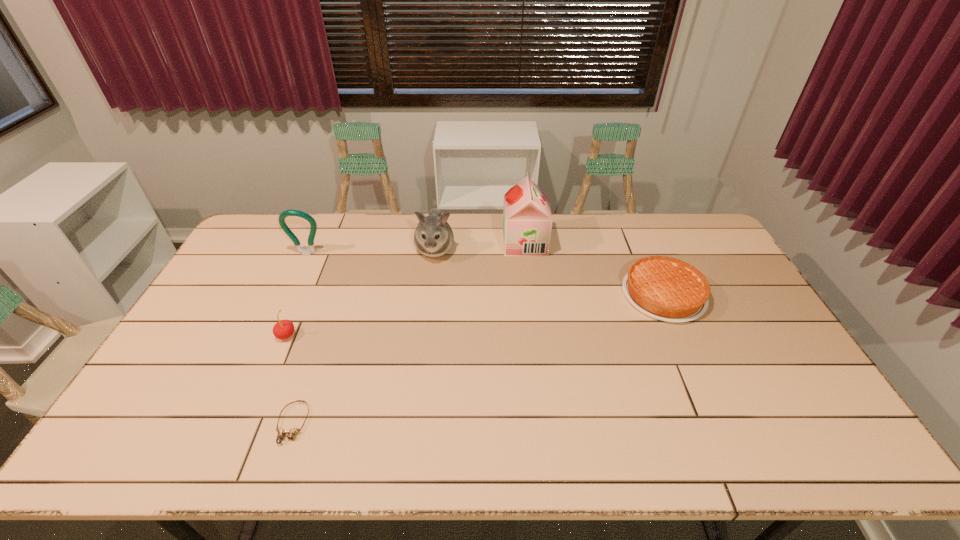
Find the location of a particular element. free space located with the cap open on the tallest object is located at coordinates (435, 243).

The height and width of the screenshot is (540, 960). In order to click on free location located 0.310m with the cap open on the tallest object in this screenshot , I will do `click(419, 243)`.

The image size is (960, 540). Identify the location of free spot located 0.370m with the cap open on the tallest object. (402, 243).

You are a GUI agent. You are given a task and a screenshot of the screen. Output one action in this format:
    pyautogui.click(x=<x>, y=<y>)
    Task: Click on the free space located 0.250m at the jaws of the bottle opener
    
    Given the screenshot: What is the action you would take?
    pyautogui.click(x=281, y=310)

Identify the location of vacant space located 0.260m on the face of the third object from right to left. The image size is (960, 540). (426, 323).

The image size is (960, 540). I want to click on vacant space located on the right of the third shortest object, so click(413, 335).

This screenshot has width=960, height=540. I want to click on vacant area situated on the front of the second shortest object, so click(683, 338).

At what (x,y) coordinates should I click in order to perform the action: click on soya milk situated at the far edge. Please return your answer as a coordinate pair (x, y). Looking at the image, I should click on 527,220.

I want to click on bottle opener that is positioned at the far edge, so click(x=311, y=250).

What are the coordinates of `hamster that is at the far edge` in the screenshot? It's located at click(x=433, y=237).